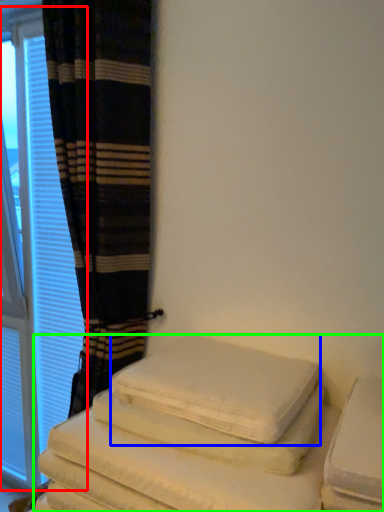
Question: Which object is positioned closest to window (highlighted by a red box)? Select from bath towel (highlighted by a blue box) and furniture (highlighted by a green box).

Choices:
 (A) bath towel
 (B) furniture

Answer: (A)